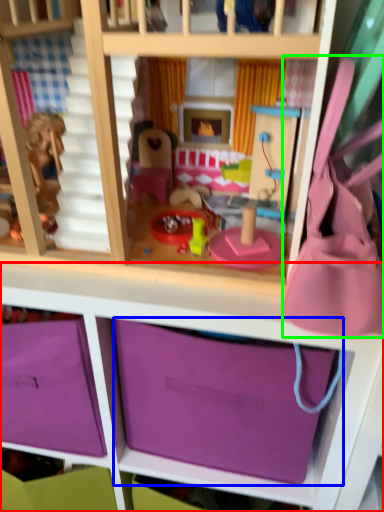
Question: Which object is the farthest from shelf (highlighted by a red box)? Choose among these: storage box (highlighted by a blue box) or accessory (highlighted by a green box).

Choices:
 (A) storage box
 (B) accessory

Answer: (B)